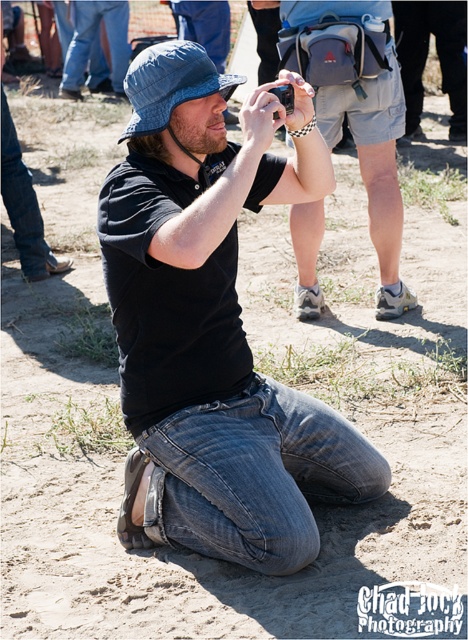
Question: Observing the image, what is the correct spatial positioning of denim jeans at center in reference to denim blue hat at center?

Choices:
 (A) left
 (B) right

Answer: (B)

Question: Which object is farther from the camera taking this photo?

Choices:
 (A) denim blue hat at center
 (B) matte black camera at center

Answer: (B)

Question: Does black matte camera at center appear under black plastic camera at center?

Choices:
 (A) no
 (B) yes

Answer: (B)

Question: Which is nearer to the matte black camera at center?

Choices:
 (A) denim blue hat at center
 (B) black matte camera at center
 (C) denim jeans at center

Answer: (A)

Question: From the image, what is the correct spatial relationship of black matte camera at center in relation to black plastic camera at center?

Choices:
 (A) left
 (B) right

Answer: (A)

Question: Which point appears farthest from the camera in this image?

Choices:
 (A) (145, 72)
 (B) (278, 92)

Answer: (B)